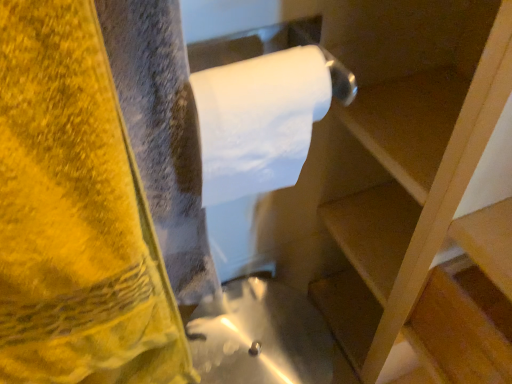
The height and width of the screenshot is (384, 512). What do you see at coordinates (431, 214) in the screenshot?
I see `wooden at upper right` at bounding box center [431, 214].

The height and width of the screenshot is (384, 512). Identify the location of wooden at upper right. (431, 214).

Find the location of a particular element. yellow velvety towel at left is located at coordinates (75, 215).

From the picture: Is white matte toilet paper at upper center closer to the viewer compared to wooden at upper right?

No.

Is wooden at upper right at the back of white matte toilet paper at upper center?

white matte toilet paper at upper center does not have its back to wooden at upper right.

Where is `toilet paper that appears on the left of wooden at upper right`? This screenshot has height=384, width=512. toilet paper that appears on the left of wooden at upper right is located at coordinates (259, 121).

Does wooden at upper right appear on the right side of yellow velvety towel at left?

Correct, you'll find wooden at upper right to the right of yellow velvety towel at left.

Is wooden at upper right facing away from yellow velvety towel at left?

wooden at upper right is not turned away from yellow velvety towel at left.

Considering the positions of objects white matte toilet paper at upper center and yellow velvety towel at left in the image provided, who is more to the left, white matte toilet paper at upper center or yellow velvety towel at left?

Positioned to the left is yellow velvety towel at left.

Find the location of a particular element. Image resolution: width=512 pixels, height=384 pixels. toilet paper located behind the yellow velvety towel at left is located at coordinates tap(259, 121).

Who is more distant, white matte toilet paper at upper center or yellow velvety towel at left?

Positioned behind is white matte toilet paper at upper center.

Is white matte toilet paper at upper center aimed at yellow velvety towel at left?

No, white matte toilet paper at upper center does not turn towards yellow velvety towel at left.

Consider the image. From the image's perspective, is wooden at upper right above or below white matte toilet paper at upper center?

wooden at upper right is below white matte toilet paper at upper center.

Which of these two, wooden at upper right or white matte toilet paper at upper center, stands shorter?

white matte toilet paper at upper center.

Is wooden at upper right placed right next to white matte toilet paper at upper center?

There is a gap between wooden at upper right and white matte toilet paper at upper center.

How different are the orientations of yellow velvety towel at left and white matte toilet paper at upper center in degrees?

There is a 2.69-degree angle between the facing directions of yellow velvety towel at left and white matte toilet paper at upper center.

Is yellow velvety towel at left directly adjacent to white matte toilet paper at upper center?

No, yellow velvety towel at left is not making contact with white matte toilet paper at upper center.

Is yellow velvety towel at left not within white matte toilet paper at upper center?

Absolutely, yellow velvety towel at left is external to white matte toilet paper at upper center.

Who is shorter, yellow velvety towel at left or white matte toilet paper at upper center?

white matte toilet paper at upper center is shorter.

Looking at this image, is yellow velvety towel at left looking in the opposite direction of wooden at upper right?

No.

Between yellow velvety towel at left and wooden at upper right, which one has less height?

Standing shorter between the two is wooden at upper right.

Consider the image. Is yellow velvety towel at left inside or outside of wooden at upper right?

yellow velvety towel at left is located beyond the bounds of wooden at upper right.

From the image's perspective, which is above, yellow velvety towel at left or wooden at upper right?

From the image's view, wooden at upper right is above.

The height and width of the screenshot is (384, 512). Identify the location of shelf below the white matte toilet paper at upper center (from a real-world perspective). (431, 214).

Locate an element on the screen. Image resolution: width=512 pixels, height=384 pixels. shelf on the right of yellow velvety towel at left is located at coordinates (431, 214).

When comparing their distances from yellow velvety towel at left, does white matte toilet paper at upper center or wooden at upper right seem further?

wooden at upper right is positioned further to the anchor yellow velvety towel at left.

Estimate the real-world distances between objects in this image. Which object is closer to wooden at upper right, yellow velvety towel at left or white matte toilet paper at upper center?

white matte toilet paper at upper center.

Looking at the image, which one is located further to white matte toilet paper at upper center, wooden at upper right or yellow velvety towel at left?

Based on the image, wooden at upper right appears to be further to white matte toilet paper at upper center.

Estimate the real-world distances between objects in this image. Which object is closer to white matte toilet paper at upper center, yellow velvety towel at left or wooden at upper right?

Among the two, yellow velvety towel at left is located nearer to white matte toilet paper at upper center.

Which object lies nearer to the anchor point wooden at upper right, white matte toilet paper at upper center or yellow velvety towel at left?

white matte toilet paper at upper center is closer to wooden at upper right.

Which object lies further to the anchor point yellow velvety towel at left, wooden at upper right or white matte toilet paper at upper center?

wooden at upper right is further to yellow velvety towel at left.

This screenshot has width=512, height=384. What are the coordinates of `toilet paper between yellow velvety towel at left and wooden at upper right` in the screenshot? It's located at (259, 121).